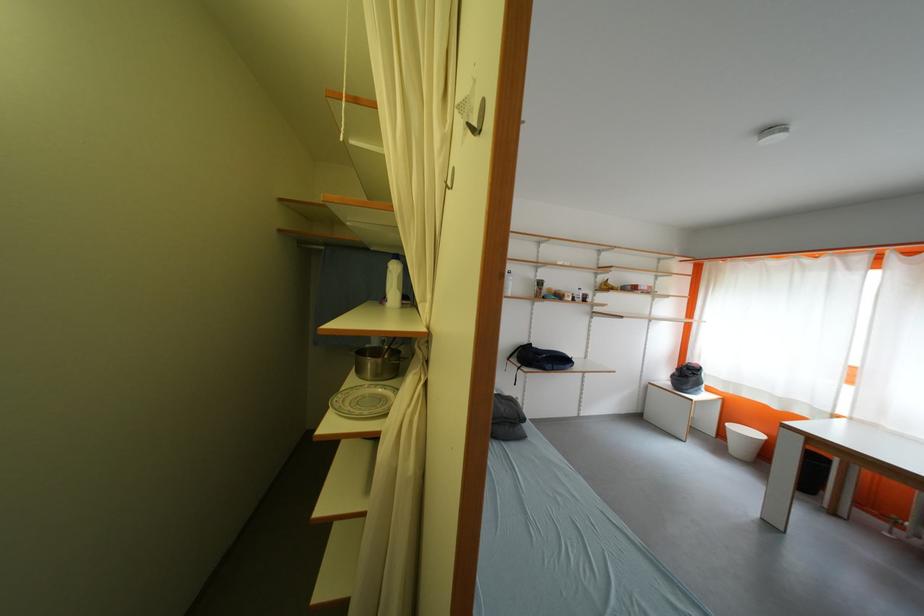
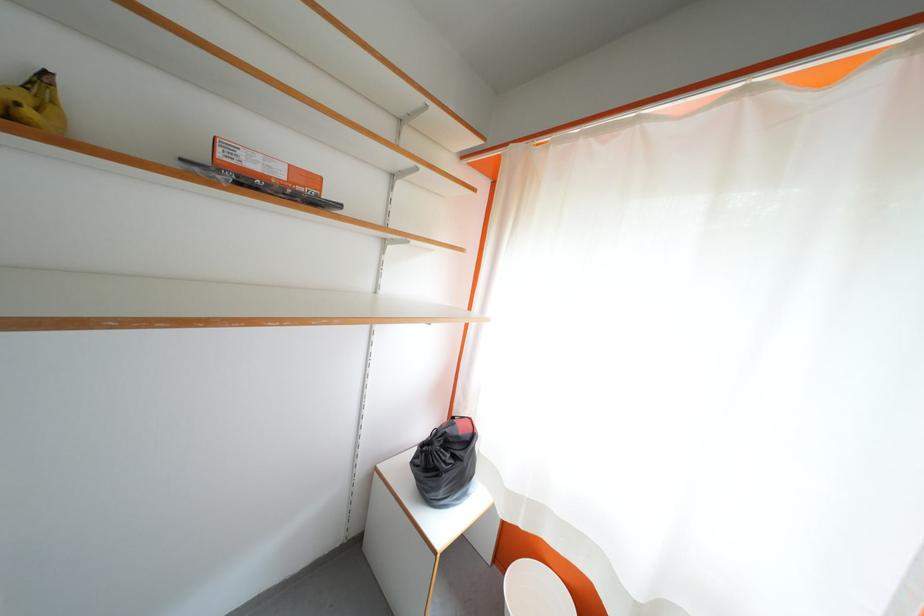
Where in the second image is the point corresponding to the point at 697,379 from the first image?

(455, 460)